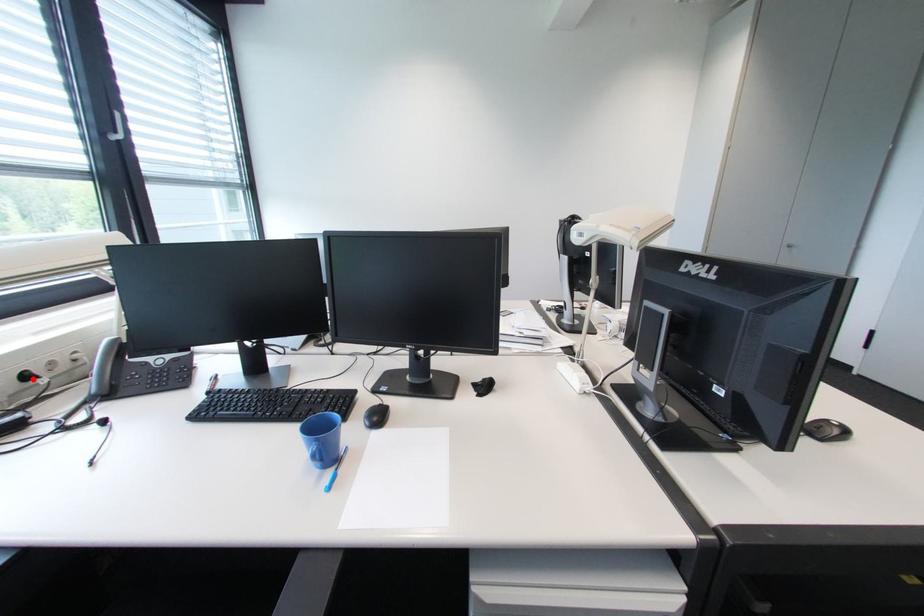
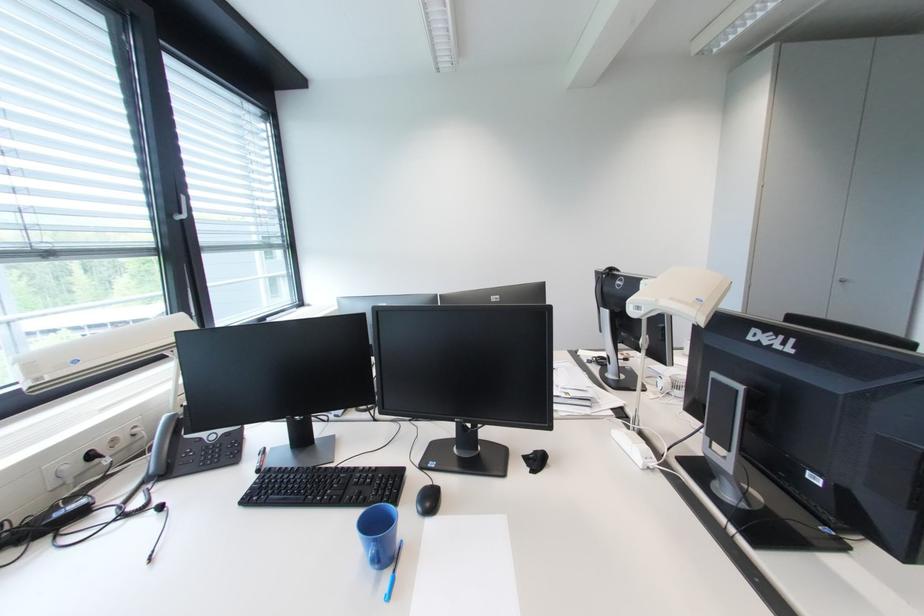
Where in the second image is the point corresponding to the highlighted location from the first image?

(98, 458)